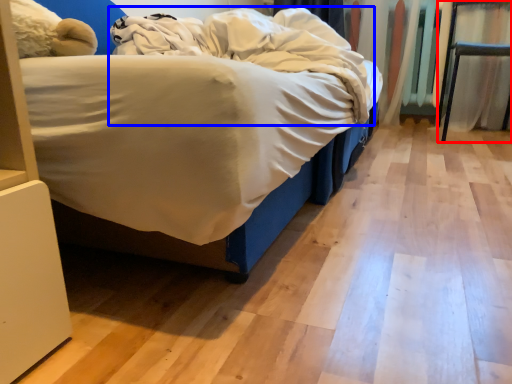
Question: Which of the following is the farthest to the observer, furniture (highlighted by a red box) or blanket (highlighted by a blue box)?

Choices:
 (A) furniture
 (B) blanket

Answer: (A)